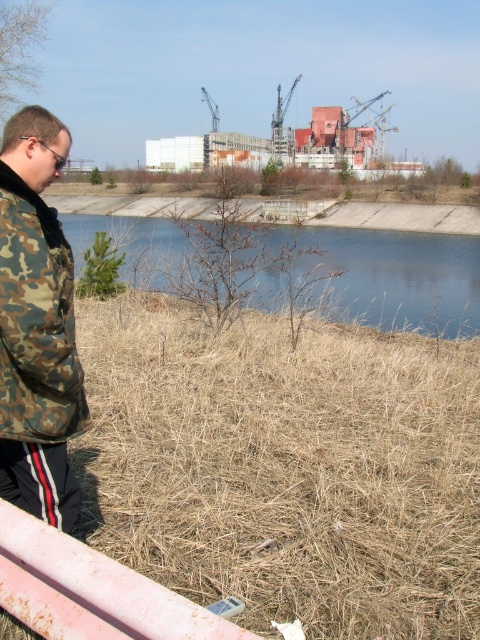
Between camo jacket at left and blue water at center, which one appears on the left side from the viewer's perspective?

Positioned to the left is camo jacket at left.

Which is above, camo jacket at left or blue water at center?

blue water at center is above.

Does point (45, 316) come farther from viewer compared to point (394, 280)?

No, it is in front of (394, 280).

You are a GUI agent. You are given a task and a screenshot of the screen. Output one action in this format:
    pyautogui.click(x=<x>, y=<y>)
    Task: Click on the camo jacket at left
    This screenshot has width=480, height=640.
    Given the screenshot: What is the action you would take?
    pyautogui.click(x=36, y=324)